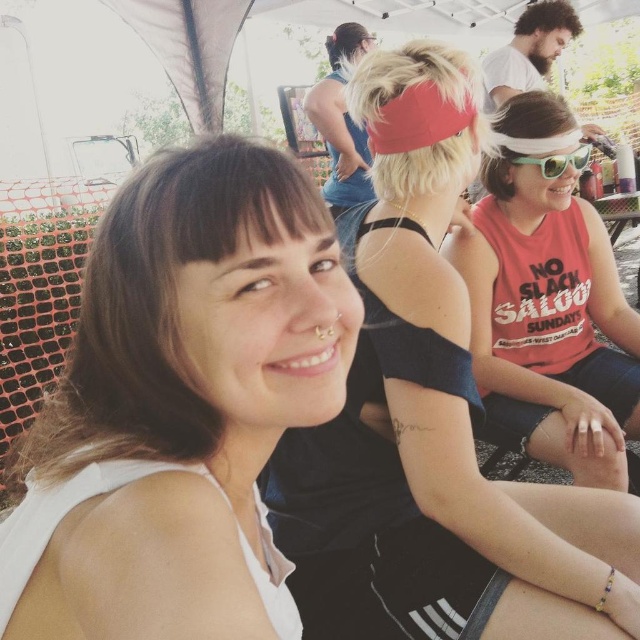
Is black matte tank top at center to the right of matte red tank top at center from the viewer's perspective?

In fact, black matte tank top at center is to the left of matte red tank top at center.

Is black matte tank top at center wider than matte red tank top at center?

Indeed, black matte tank top at center has a greater width compared to matte red tank top at center.

Who is more forward, (416, 636) or (532, 406)?

Point (416, 636)

The height and width of the screenshot is (640, 640). Find the location of `black matte tank top at center`. black matte tank top at center is located at coordinates (416, 404).

Does white matte tank top at left appear on the left side of green plastic sunglasses at upper right?

Answer: Correct, you'll find white matte tank top at left to the left of green plastic sunglasses at upper right.

Between white matte tank top at left and green plastic sunglasses at upper right, which one has less height?

green plastic sunglasses at upper right

Does point (84, 339) come farther from viewer compared to point (532, 163)?

No.

Locate an element on the screen. The image size is (640, 640). white matte tank top at left is located at coordinates (184, 401).

Between white matte tank top at left and matte red tank top at center, which one is positioned lower?

white matte tank top at left

Does white matte tank top at left have a lesser height compared to matte red tank top at center?

Yes, white matte tank top at left is shorter than matte red tank top at center.

Locate an element on the screen. The height and width of the screenshot is (640, 640). white matte tank top at left is located at coordinates (184, 401).